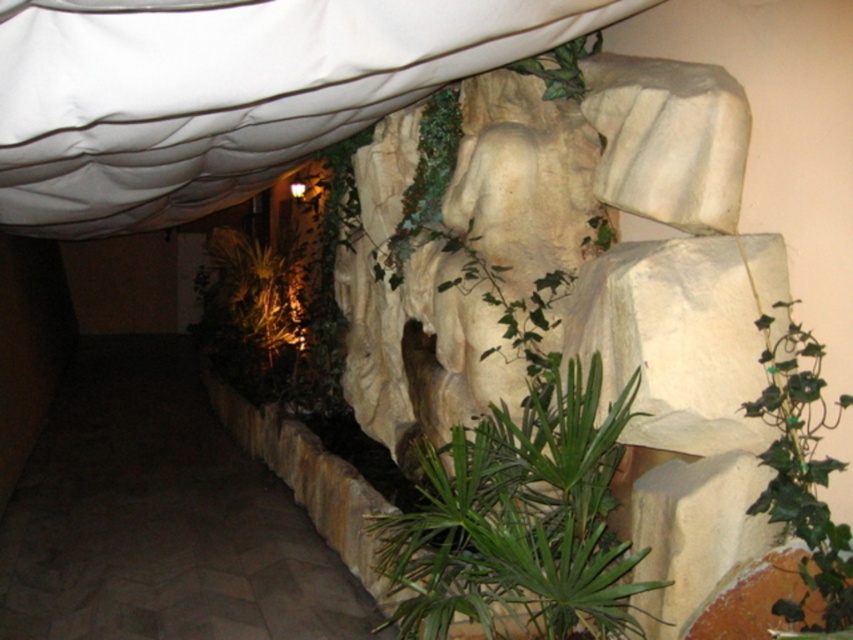
Consider the image. You are standing in the indoor scene described. You want to place a small decorative statue exactly at the center of the image. However, there is already a green leafy plant at center. Can you place the statue there without moving the plant?

The green leafy plant at center is already located at the center of the image, so you cannot place the statue there without moving the plant.

You are standing at the entrance of the themed room and want to reach the brown stone pathway at lower left. Based on the coordinates provided, is the pathway closer to the left or right side of the scene?

The brown stone pathway at lower left is located at point 0.812 on the x and 0.189 on the y. Since the x coordinate is closer to 1, which typically represents the right side in coordinate systems, the pathway is closer to the right side of the scene. However, the object label mentions it is at the lower left, which might indicate a discrepancy. Please verify the coordinate system orientation.

You are standing at the entrance of the indoor garden and want to reach the green leafy plant at center. Which direction should you move relative to the brown stone pathway at lower left?

You should move to the right of the brown stone pathway at lower left to reach the green leafy plant at center since the green leafy plant at center is to the right of the brown stone pathway at lower left.